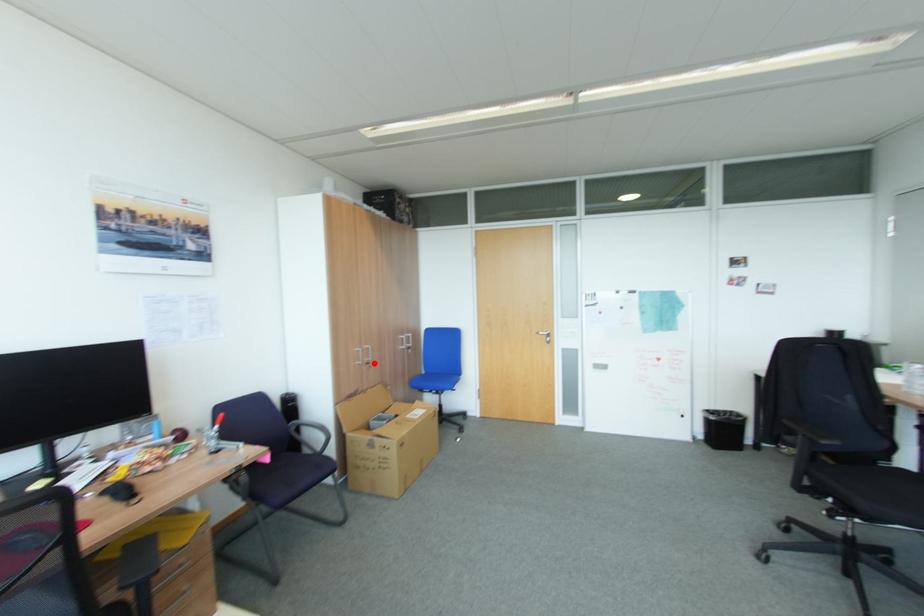
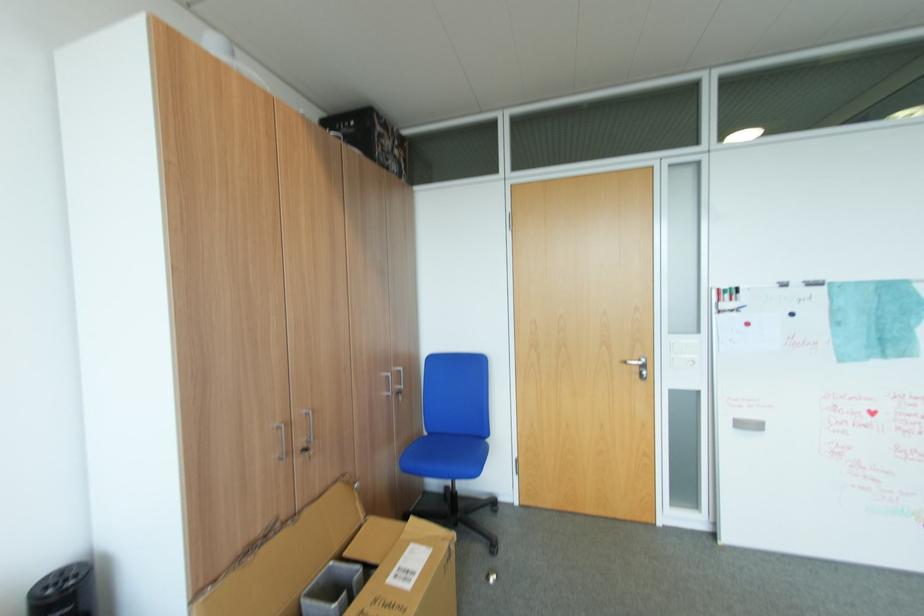
Locate, in the second image, the point that corresponds to the highlighted location in the first image.

(310, 451)